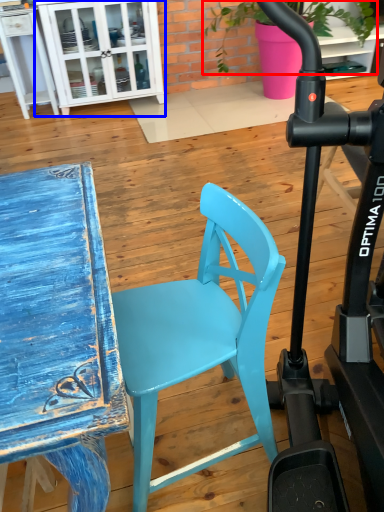
Question: Which object appears farthest to the camera in this image, plant (highlighted by a red box) or cabinetry (highlighted by a blue box)?

Choices:
 (A) plant
 (B) cabinetry

Answer: (B)